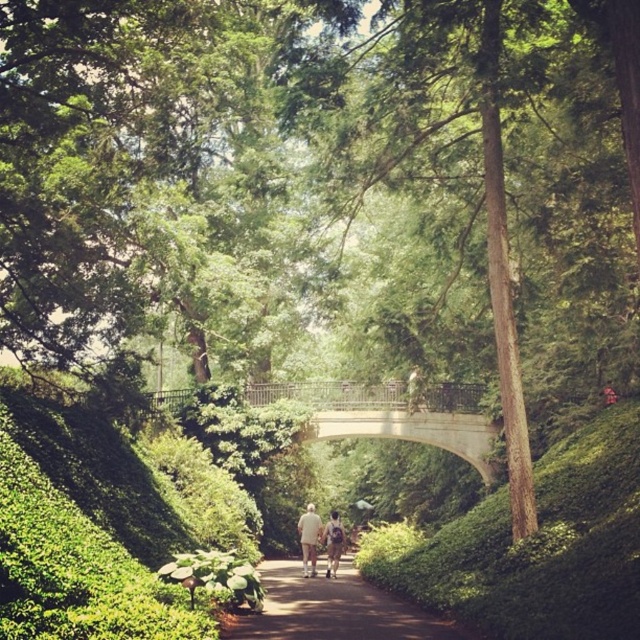
Which is behind, point (444, 413) or point (305, 506)?

The point (305, 506) is more distant.

Does concrete stone bridge at center have a greater height compared to light beige fabric at center?

Incorrect, concrete stone bridge at center's height is not larger of light beige fabric at center's.

Is point (401, 381) positioned in front of point (312, 509)?

That is False.

Where is `concrete stone bridge at center`? The image size is (640, 640). concrete stone bridge at center is located at coordinates (394, 413).

The image size is (640, 640). Describe the element at coordinates (333, 609) in the screenshot. I see `brown dirt path at center` at that location.

Can you confirm if brown dirt path at center is positioned above light beige fabric couple at center?

Indeed, brown dirt path at center is positioned over light beige fabric couple at center.

Locate an element on the screen. The height and width of the screenshot is (640, 640). brown dirt path at center is located at coordinates (333, 609).

Can you confirm if brown dirt path at center is smaller than light beige fabric at center?

No.

Is brown dirt path at center shorter than light beige fabric at center?

Yes.

Identify the location of brown dirt path at center. This screenshot has width=640, height=640. (333, 609).